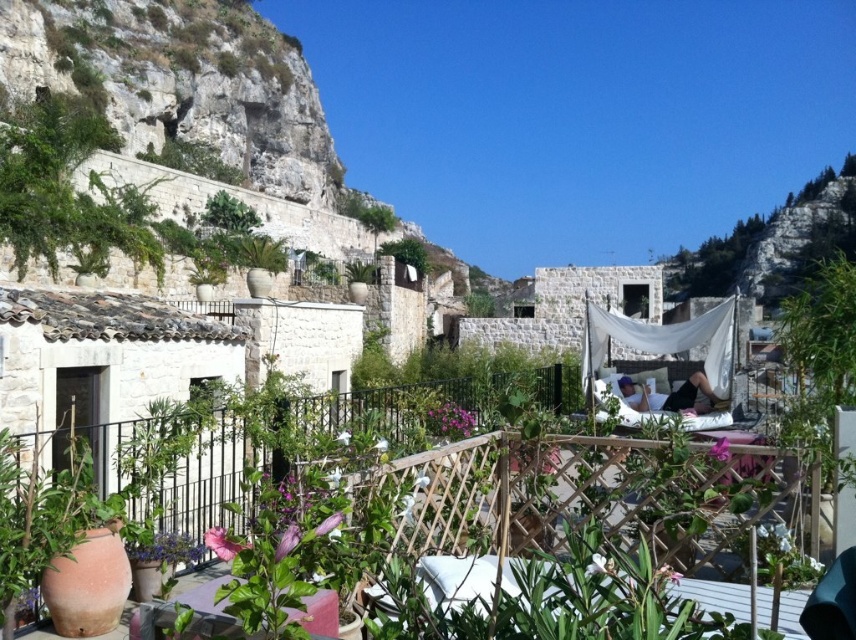
Question: Does green bamboo at right appear over green leafy plant at center?

Choices:
 (A) no
 (B) yes

Answer: (A)

Question: Which point is farther to the camera?

Choices:
 (A) green bamboo at right
 (B) white fabric canopy at center

Answer: (B)

Question: Does green bamboo at right appear on the left side of white fabric canopy at center?

Choices:
 (A) yes
 (B) no

Answer: (B)

Question: Which of these objects is positioned farthest from the green leafy plant at center?

Choices:
 (A) green bamboo at right
 (B) white fabric canopy at center

Answer: (A)

Question: Which object is closer to the camera taking this photo?

Choices:
 (A) green leafy plant at center
 (B) white fabric canopy at center

Answer: (B)

Question: Can you confirm if white fabric canopy at center is wider than green leafy plant at center?

Choices:
 (A) no
 (B) yes

Answer: (B)